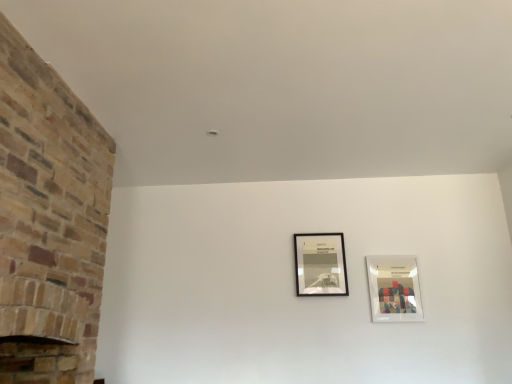
Question: From the image's perspective, would you say brick fireplace at left is shown under black matte picture frame at center, the 1th picture frame viewed from the left?

Choices:
 (A) yes
 (B) no

Answer: (B)

Question: Considering the relative sizes of brick fireplace at left and black matte picture frame at center, the 1th picture frame viewed from the left, in the image provided, is brick fireplace at left bigger than black matte picture frame at center, the 1th picture frame viewed from the left,?

Choices:
 (A) no
 (B) yes

Answer: (B)

Question: Is brick fireplace at left wider than black matte picture frame at center, the 1th picture frame viewed from the left?

Choices:
 (A) yes
 (B) no

Answer: (A)

Question: Does brick fireplace at left come in front of black matte picture frame at center, the 1th picture frame viewed from the left?

Choices:
 (A) yes
 (B) no

Answer: (A)

Question: Considering the relative sizes of brick fireplace at left and black matte picture frame at center, the 1th picture frame viewed from the left, in the image provided, is brick fireplace at left taller than black matte picture frame at center, the 1th picture frame viewed from the left,?

Choices:
 (A) yes
 (B) no

Answer: (A)

Question: Does brick fireplace at left have a lesser height compared to black matte picture frame at center, marked as the second picture frame in a right-to-left arrangement?

Choices:
 (A) yes
 (B) no

Answer: (B)

Question: Does black matte picture frame at center, marked as the second picture frame in a right-to-left arrangement, appear on the left side of brick fireplace at left?

Choices:
 (A) yes
 (B) no

Answer: (B)

Question: From a real-world perspective, does black matte picture frame at center, the 1th picture frame viewed from the left, sit lower than brick fireplace at left?

Choices:
 (A) no
 (B) yes

Answer: (A)

Question: Is black matte picture frame at center, the 1th picture frame viewed from the left, looking in the opposite direction of brick fireplace at left?

Choices:
 (A) no
 (B) yes

Answer: (A)

Question: Is black matte picture frame at center, marked as the second picture frame in a right-to-left arrangement, outside of brick fireplace at left?

Choices:
 (A) yes
 (B) no

Answer: (A)

Question: Can you confirm if black matte picture frame at center, marked as the second picture frame in a right-to-left arrangement, is taller than brick fireplace at left?

Choices:
 (A) yes
 (B) no

Answer: (B)

Question: Does black matte picture frame at center, the 1th picture frame viewed from the left, have a lesser height compared to brick fireplace at left?

Choices:
 (A) no
 (B) yes

Answer: (B)

Question: Does black matte picture frame at center, marked as the second picture frame in a right-to-left arrangement, appear on the right side of white glossy picture frame at upper right, the second picture frame positioned from the left?

Choices:
 (A) no
 (B) yes

Answer: (A)